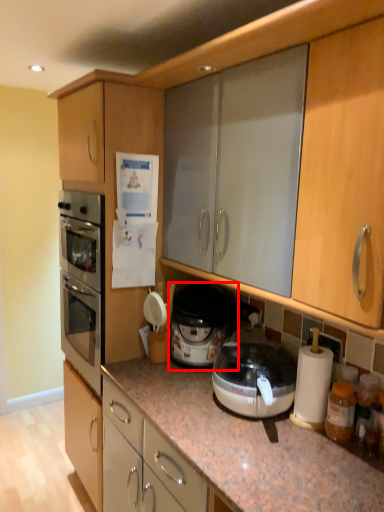
Question: In this image, where is cooker (annotated by the red box) located relative to cabinetry?

Choices:
 (A) left
 (B) right

Answer: (B)